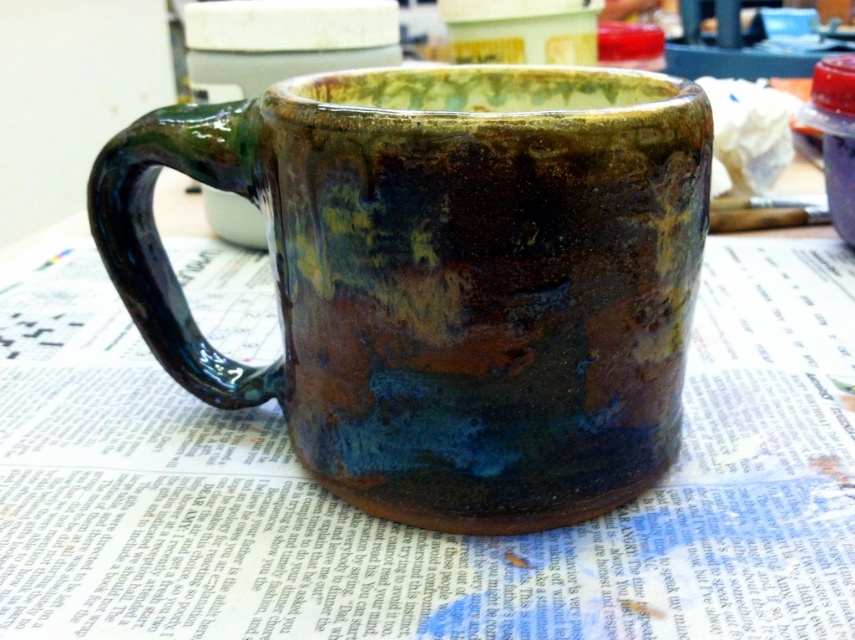
You are trying to fit a matte ceramic mug at center and a rustic ceramic mug at center into a drawer that can only accommodate one of them. Based on their widths, which one is more likely to fit?

The rustic ceramic mug at center is more likely to fit in the drawer since it might be narrower than the matte ceramic mug at center.

You are a barista preparing a customer order. You have two mugs available in front of you, the matte ceramic mug at center and the rustic ceramic mug at center. The customer wants the largest mug available. Which one should you choose?

The matte ceramic mug at center has a larger size compared to the rustic ceramic mug at center, so you should choose the matte ceramic mug at center.

In the scene shown: You are arranging items on a table and need to place both the matte ceramic mug at center and the rustic ceramic mug at center. According to their positions in the image, which mug should you place first if you want to follow the left to right arrangement?

The rustic ceramic mug at center should be placed first because it is on the left side of the matte ceramic mug at center, following a left to right arrangement.